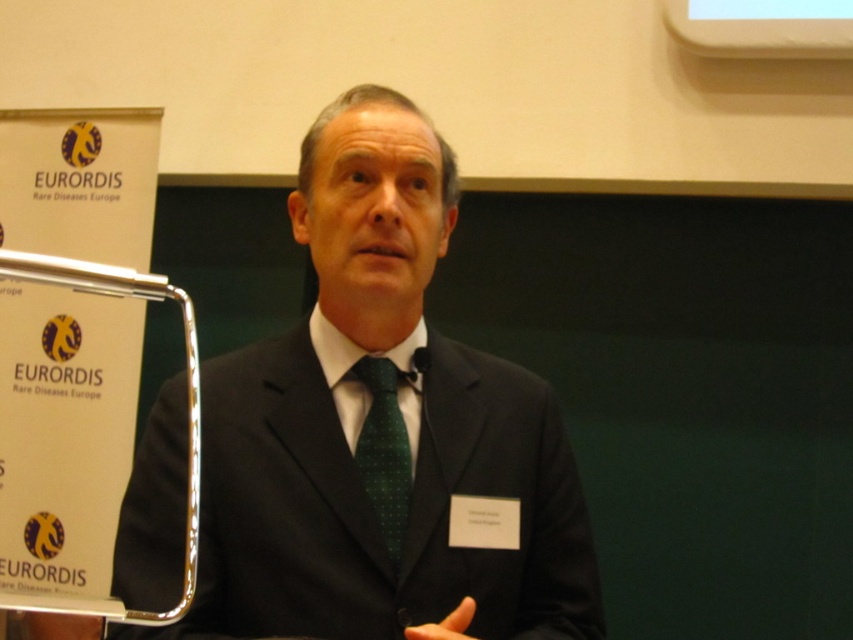
You are an event photographer at the EURORDIS Rare Diseases Europe conference. You need to capture a closeup shot of the speaker while ensuring both the black matte suit at center and the green dotted fabric tie at center are visible. Since the camera frame can only focus on one side, which side should you position the focus to capture both objects?

The black matte suit at center is positioned on the left side of green dotted fabric tie at center. To capture both objects in the frame, focus on the left side where the black matte suit at center is located so that the green dotted fabric tie at center remains within the same view.

You are an event organizer and need to place a small podium for the speaker. The podium should be positioned so that it does not block the banner in the background. Given the speaker is standing at point (381, 433), which represents the black matte suit at center, where should the podium be placed relative to this point?

The podium should be placed in front of the speaker at point (381, 433) to avoid blocking the banner behind him.